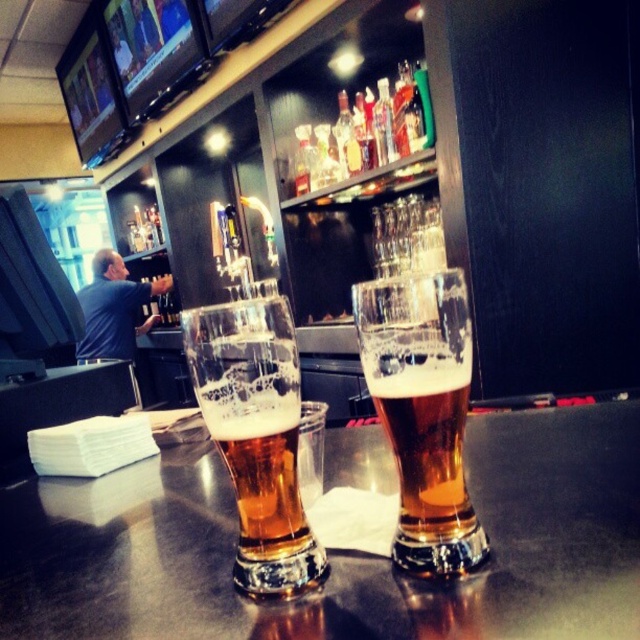
Question: Among these points, which one is nearest to the camera?

Choices:
 (A) (428, 308)
 (B) (113, 259)
 (C) (253, 488)

Answer: (A)

Question: From the image, what is the correct spatial relationship of translucent glass table at center in relation to translucent glass beer at center?

Choices:
 (A) above
 (B) below

Answer: (B)

Question: Which point appears farthest from the camera in this image?

Choices:
 (A) (422, 632)
 (B) (234, 458)
 (C) (209, 388)
 (D) (416, 360)

Answer: (B)

Question: Which point is closer to the camera taking this photo?

Choices:
 (A) (131, 356)
 (B) (625, 404)
 (C) (256, 458)

Answer: (C)

Question: Is translucent glass table at center below clear glass beer at center?

Choices:
 (A) no
 (B) yes

Answer: (B)

Question: Is translucent glass table at center thinner than blue shirt at left?

Choices:
 (A) yes
 (B) no

Answer: (B)